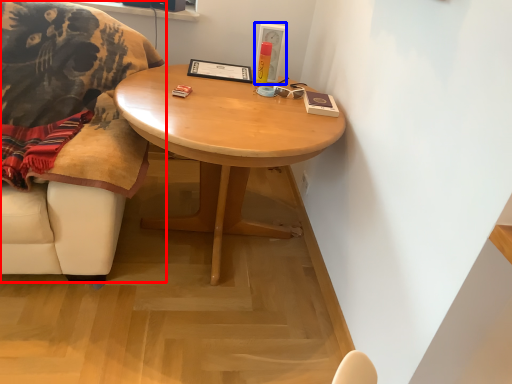
Question: Among these objects, which one is nearest to the camera, chair (highlighted by a red box) or picture frame (highlighted by a blue box)?

Choices:
 (A) chair
 (B) picture frame

Answer: (A)